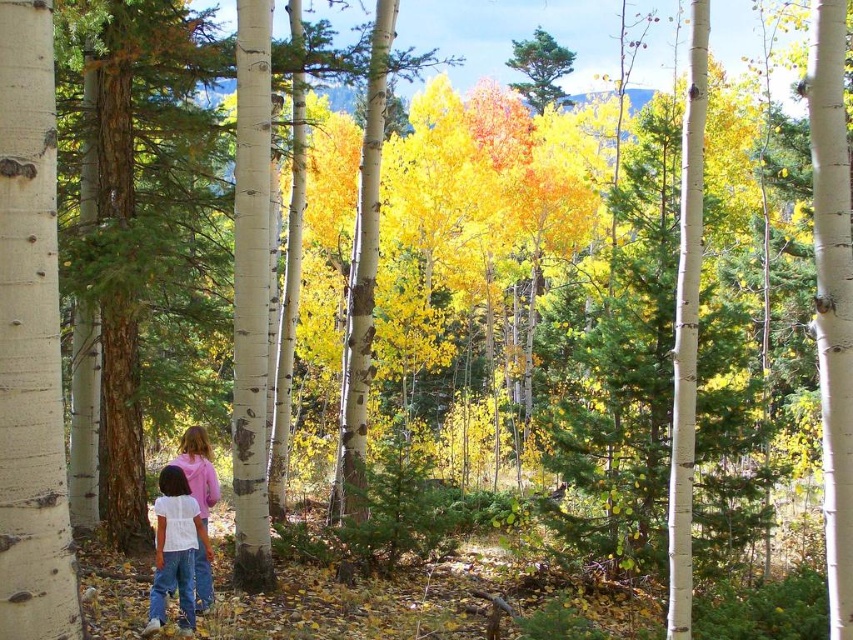
Does white cotton shirt at lower center appear over white cotton shirt at center?

No.

You are a GUI agent. You are given a task and a screenshot of the screen. Output one action in this format:
    pyautogui.click(x=<x>, y=<y>)
    Task: Click on the white cotton shirt at lower center
    
    Given the screenshot: What is the action you would take?
    pyautogui.click(x=175, y=548)